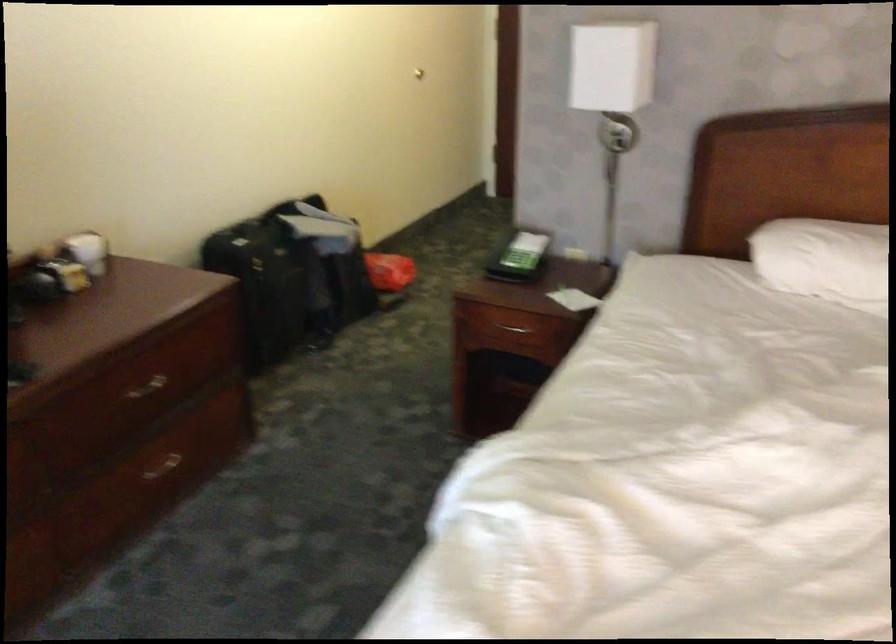
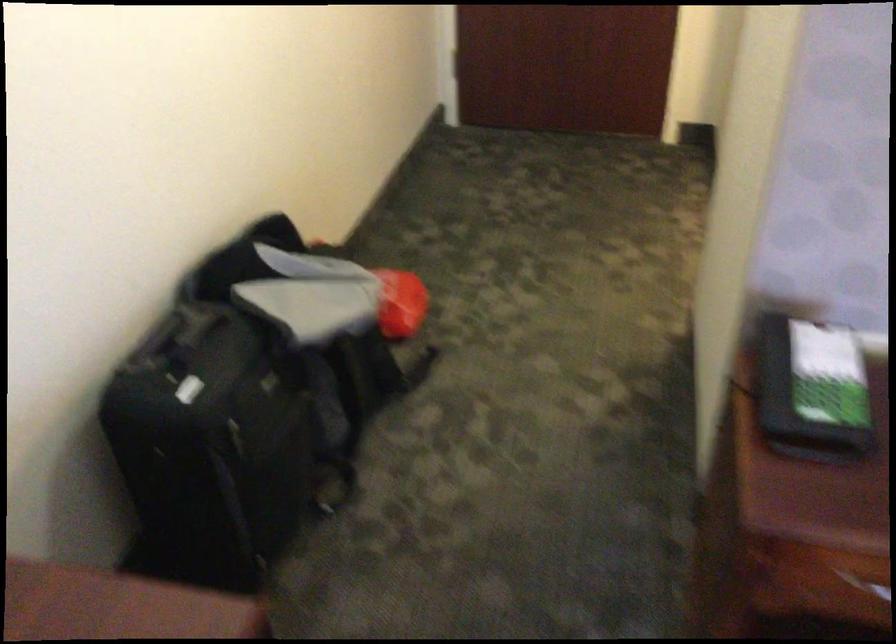
The point at (401, 268) is marked in the first image. Where is the corresponding point in the second image?

(401, 303)